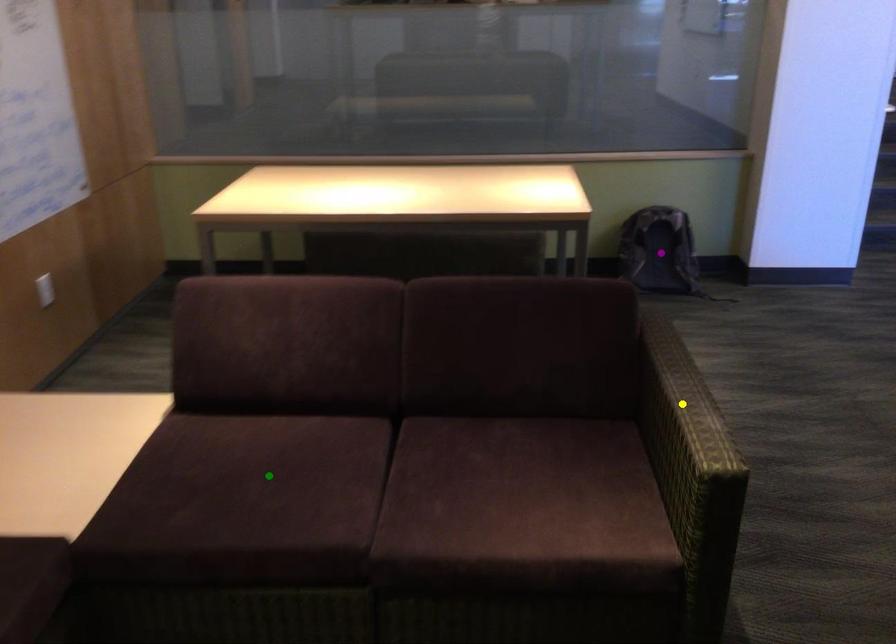
Order these from farthest to nearest:
- purple point
- green point
- yellow point

purple point → green point → yellow point